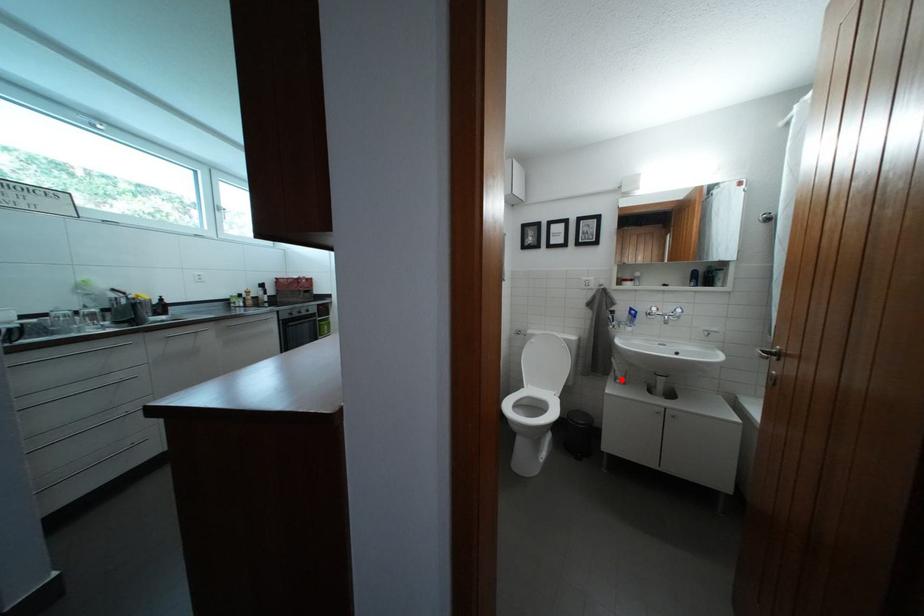
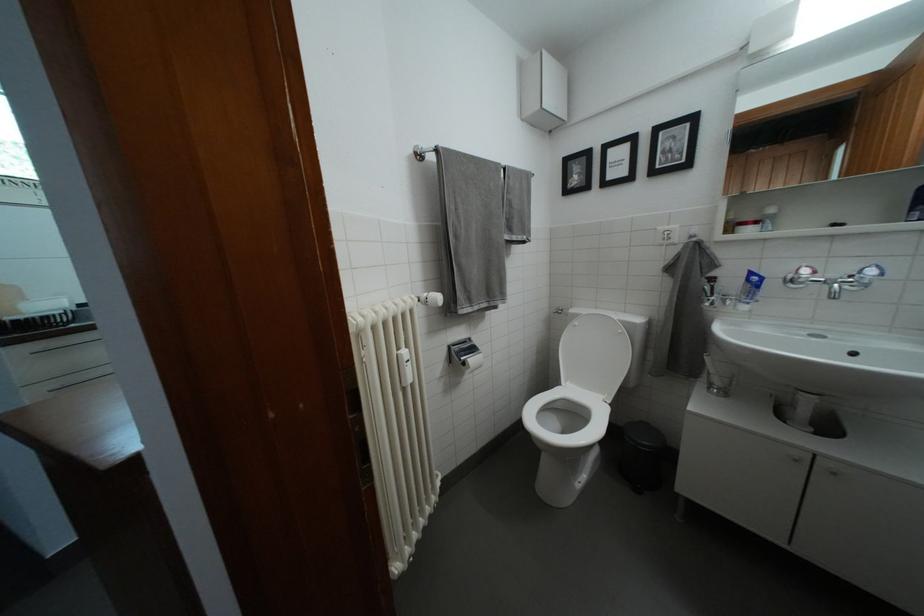
Find the pixel in the second image that matches the highlighted location in the first image.

(714, 382)